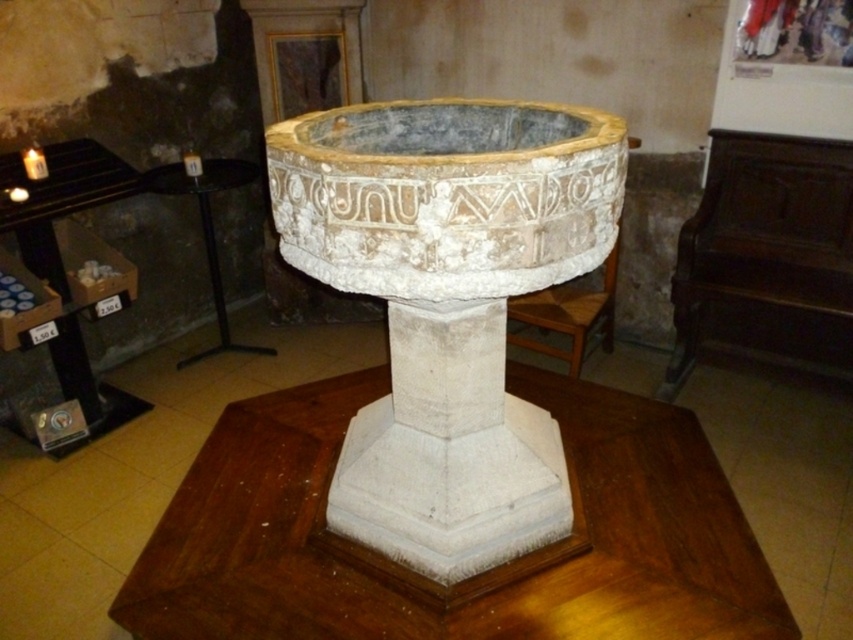
Question: Can you confirm if wooden table at center is smaller than black wood table at left?

Choices:
 (A) no
 (B) yes

Answer: (A)

Question: Can you confirm if wooden table at center is bigger than black wood table at left?

Choices:
 (A) yes
 (B) no

Answer: (A)

Question: Is wooden table at center below black wood table at left?

Choices:
 (A) no
 (B) yes

Answer: (B)

Question: Which object is closer to the camera taking this photo?

Choices:
 (A) wooden table at center
 (B) black wood table at left

Answer: (A)

Question: Which point is farther from the camera taking this photo?

Choices:
 (A) (24, 209)
 (B) (416, 602)

Answer: (A)

Question: Which point appears farthest from the camera in this image?

Choices:
 (A) (264, 518)
 (B) (28, 202)

Answer: (B)